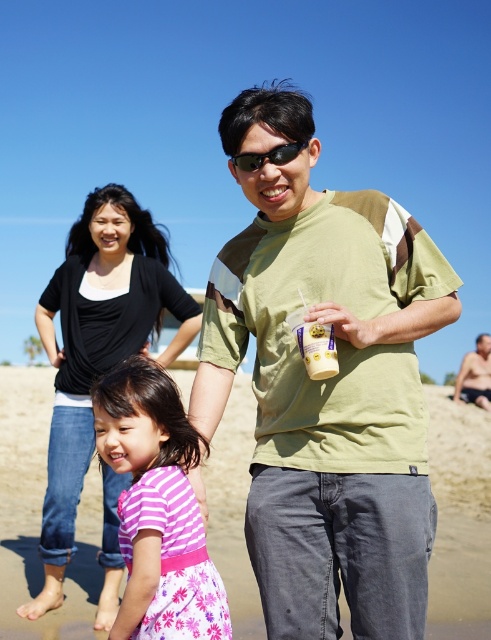
The height and width of the screenshot is (640, 491). I want to click on fine-grained sand at lower center, so click(x=39, y=509).

Between fine-grained sand at lower center and skinny man at right, which one is positioned higher?

skinny man at right

The width and height of the screenshot is (491, 640). Describe the element at coordinates (39, 509) in the screenshot. I see `fine-grained sand at lower center` at that location.

You are a GUI agent. You are given a task and a screenshot of the screen. Output one action in this format:
    pyautogui.click(x=<x>, y=<y>)
    Task: Click on the fine-grained sand at lower center
    This screenshot has width=491, height=640.
    Given the screenshot: What is the action you would take?
    pyautogui.click(x=39, y=509)

Where is `green cotton shirt at center`? green cotton shirt at center is located at coordinates (326, 385).

Describe the element at coordinates (326, 385) in the screenshot. I see `green cotton shirt at center` at that location.

Identify the location of green cotton shirt at center. The width and height of the screenshot is (491, 640). (326, 385).

Which of these two, green cotton shirt at center or black cotton shirt at upper left, stands shorter?

Standing shorter between the two is green cotton shirt at center.

Can you confirm if green cotton shirt at center is thinner than black cotton shirt at upper left?

Yes.

The image size is (491, 640). What do you see at coordinates (326, 385) in the screenshot? I see `green cotton shirt at center` at bounding box center [326, 385].

Where is `green cotton shirt at center`? Image resolution: width=491 pixels, height=640 pixels. green cotton shirt at center is located at coordinates (326, 385).